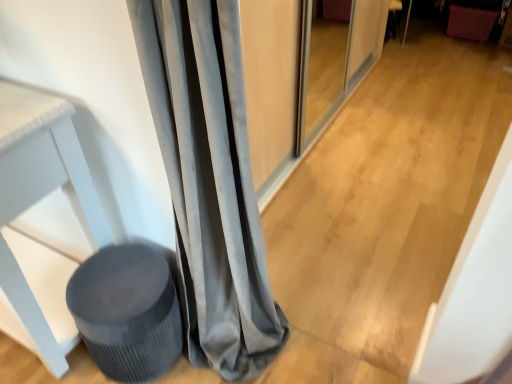
At what (x,y) coordinates should I click in order to perform the action: click on free location in front of matte gray screen door at center. Please return your answer as a coordinate pair (x, y). Looking at the image, I should click on (362, 207).